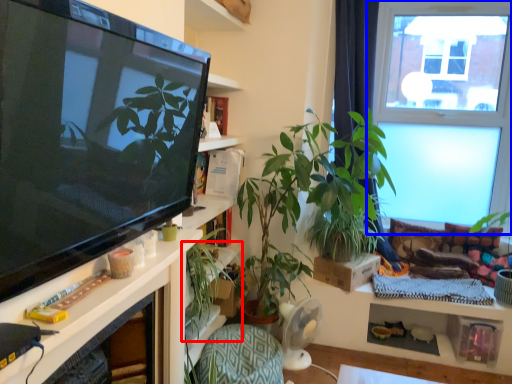
Question: Which of the following is the farthest to the observer, houseplant (highlighted by a red box) or window (highlighted by a blue box)?

Choices:
 (A) houseplant
 (B) window

Answer: (B)